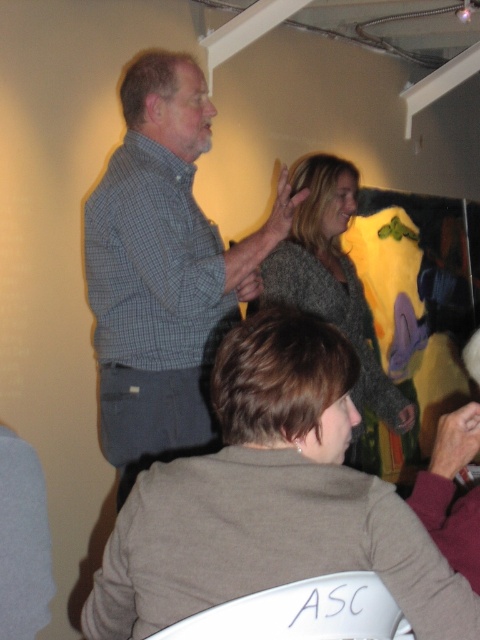
Is gray checkered shirt at center taller than velvet maroon sweater at lower right?

Indeed, gray checkered shirt at center has a greater height compared to velvet maroon sweater at lower right.

This screenshot has height=640, width=480. What do you see at coordinates (163, 269) in the screenshot?
I see `gray checkered shirt at center` at bounding box center [163, 269].

Between point (132, 385) and point (428, 515), which one is positioned behind?

The point (132, 385) is more distant.

Locate an element on the screen. This screenshot has width=480, height=640. gray checkered shirt at center is located at coordinates (163, 269).

I want to click on matte gray sweater at lower center, so click(x=271, y=499).

Is matte gray sweater at lower center thinner than knitted gray sweater at upper center?

→ Correct, matte gray sweater at lower center's width is less than knitted gray sweater at upper center's.

At what (x,y) coordinates should I click in order to perform the action: click on matte gray sweater at lower center. Please return your answer as a coordinate pair (x, y). The image size is (480, 640). Looking at the image, I should click on (271, 499).

Who is positioned more to the left, matte gray sweater at lower center or gray checkered shirt at center?

Positioned to the left is gray checkered shirt at center.

Image resolution: width=480 pixels, height=640 pixels. What do you see at coordinates (271, 499) in the screenshot?
I see `matte gray sweater at lower center` at bounding box center [271, 499].

Identify the location of matte gray sweater at lower center. This screenshot has height=640, width=480. (271, 499).